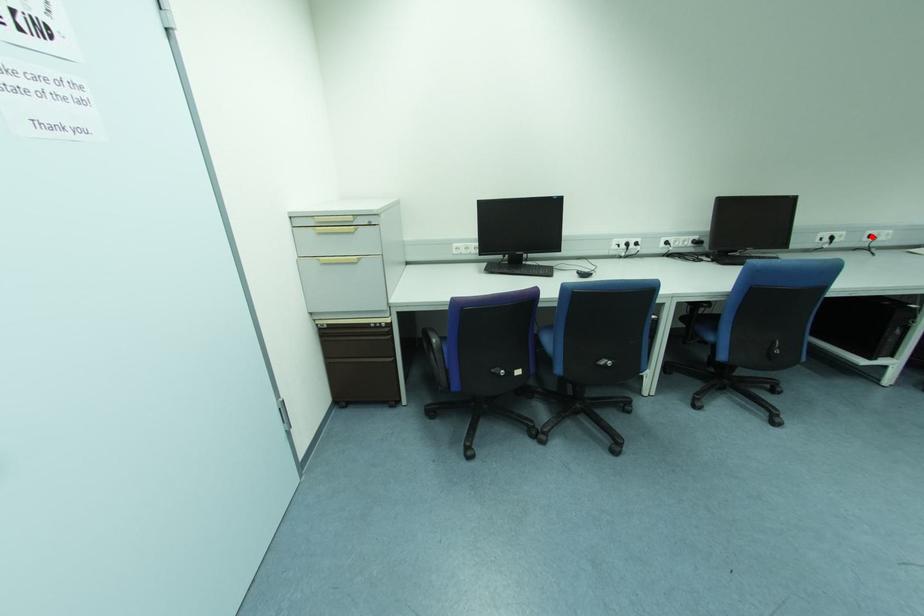
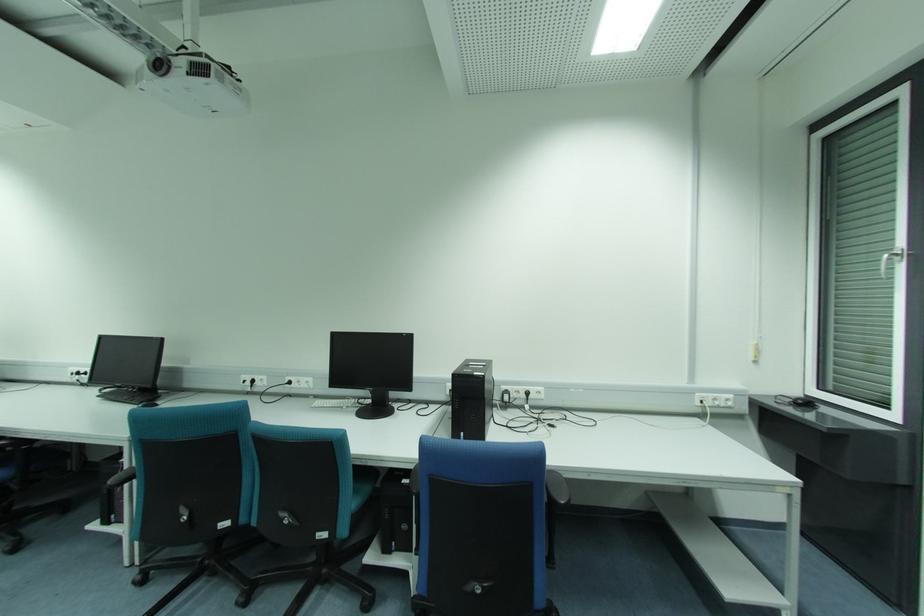
Question: A red point is marked in image1. In image2, is the corresponding 3D point closer to the camera or farther? Reply with the corresponding letter.

Choices:
 (A) The corresponding 3D point is closer.
 (B) The corresponding 3D point is farther.

Answer: (A)